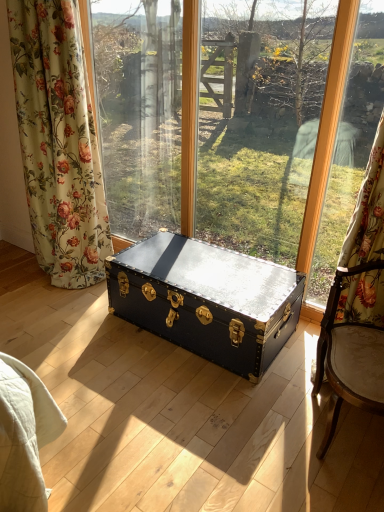
The height and width of the screenshot is (512, 384). I want to click on floral fabric curtain at left, so click(59, 142).

Describe the element at coordinates (59, 142) in the screenshot. This screenshot has width=384, height=512. I see `floral fabric curtain at left` at that location.

Describe the element at coordinates (279, 128) in the screenshot. I see `matte black trunk at center` at that location.

Identify the location of shiny black trunk at center. Image resolution: width=384 pixels, height=512 pixels. (207, 300).

Does shiny black trunk at center come in front of wooden frame at right?

No, the depth of shiny black trunk at center is greater than that of wooden frame at right.

Is point (166, 322) closer to viewer compared to point (299, 257)?

That is True.

From the image's perspective, is shiny black trunk at center below wooden frame at right?

Correct, shiny black trunk at center appears lower than wooden frame at right in the image.

Does matte black trunk at center come in front of wooden frame at right?

No.

Considering the positions of objects matte black trunk at center and wooden frame at right in the image provided, who is more to the right, matte black trunk at center or wooden frame at right?

From the viewer's perspective, wooden frame at right appears more on the right side.

Could wooden frame at right be considered to be inside matte black trunk at center?

No, wooden frame at right is not inside matte black trunk at center.

From the image's perspective, is matte black trunk at center over wooden frame at right?

Yes, from the image's perspective, matte black trunk at center is above wooden frame at right.

Considering the sizes of objects floral fabric curtain at left and matte black trunk at center in the image provided, who is bigger, floral fabric curtain at left or matte black trunk at center?

matte black trunk at center.

Considering the positions of objects floral fabric curtain at left and matte black trunk at center in the image provided, who is more to the left, floral fabric curtain at left or matte black trunk at center?

Positioned to the left is floral fabric curtain at left.

Relative to matte black trunk at center, is floral fabric curtain at left in front or behind?

Clearly, floral fabric curtain at left is behind matte black trunk at center.

From the image's perspective, is floral fabric curtain at left positioned above or below matte black trunk at center?

floral fabric curtain at left is situated higher than matte black trunk at center in the image.

From a real-world perspective, does matte black trunk at center stand above floral fabric curtain at left?

Actually, matte black trunk at center is physically below floral fabric curtain at left in the real world.

Does matte black trunk at center have a lesser width compared to floral fabric curtain at left?

Yes, matte black trunk at center is thinner than floral fabric curtain at left.

Is matte black trunk at center positioned far away from floral fabric curtain at left?

That's right, there is a large distance between matte black trunk at center and floral fabric curtain at left.

Where is `curtain behind the matte black trunk at center`? This screenshot has height=512, width=384. curtain behind the matte black trunk at center is located at coordinates (59, 142).

Is point (25, 74) closer or farther from the camera than point (339, 197)?

Clearly, point (25, 74) is closer to the camera than point (339, 197).

Is floral fabric curtain at left not near wooden frame at right?

Absolutely, floral fabric curtain at left is distant from wooden frame at right.

Is floral fabric curtain at left to the right of wooden frame at right from the viewer's perspective?

No.

Looking at this image, from the image's perspective, relative to wooden frame at right, is floral fabric curtain at left above or below?

Clearly, from the image's perspective, floral fabric curtain at left is above wooden frame at right.

Measure the distance from wooden frame at right to shiny black trunk at center.

wooden frame at right and shiny black trunk at center are 61.19 centimeters apart from each other.

Looking at this image, between wooden frame at right and shiny black trunk at center, which one has smaller width?

With smaller width is wooden frame at right.

Between wooden frame at right and shiny black trunk at center, which one is positioned in front?

Positioned in front is wooden frame at right.

Considering the positions of point (305, 217) and point (159, 320), is point (305, 217) closer or farther from the camera than point (159, 320)?

Point (305, 217).

This screenshot has width=384, height=512. I want to click on window that appears above the shiny black trunk at center (from the image's perspective), so click(279, 128).

From the image's perspective, which one is positioned higher, matte black trunk at center or shiny black trunk at center?

matte black trunk at center, from the image's perspective.

Based on their positions, is matte black trunk at center located to the left or right of shiny black trunk at center?

matte black trunk at center is positioned on shiny black trunk at center's right side.

Identify the location of table below the wooden frame at right (from a real-world perspective). (207, 300).

Image resolution: width=384 pixels, height=512 pixels. Find the location of `window located above the wooden frame at right (from a real-world perspective)`. window located above the wooden frame at right (from a real-world perspective) is located at coordinates (279, 128).

Considering their positions, is matte black trunk at center positioned further to wooden frame at right than shiny black trunk at center?

matte black trunk at center lies further to wooden frame at right than the other object.

When comparing their distances from matte black trunk at center, does shiny black trunk at center or floral fabric curtain at left seem further?

shiny black trunk at center is further to matte black trunk at center.

Based on their spatial positions, is wooden frame at right or floral fabric curtain at left further from matte black trunk at center?

Among the two, floral fabric curtain at left is located further to matte black trunk at center.

Which object lies nearer to the anchor point matte black trunk at center, wooden frame at right or shiny black trunk at center?

wooden frame at right lies closer to matte black trunk at center than the other object.

Looking at the image, which one is located further to wooden frame at right, shiny black trunk at center or matte black trunk at center?

matte black trunk at center.

When comparing their distances from matte black trunk at center, does floral fabric curtain at left or shiny black trunk at center seem further?

shiny black trunk at center.

From the image, which object appears to be nearer to wooden frame at right, shiny black trunk at center or floral fabric curtain at left?

shiny black trunk at center is positioned closer to the anchor wooden frame at right.

Based on their spatial positions, is wooden frame at right or floral fabric curtain at left closer to shiny black trunk at center?

Based on the image, wooden frame at right appears to be nearer to shiny black trunk at center.

You are a GUI agent. You are given a task and a screenshot of the screen. Output one action in this format:
    pyautogui.click(x=<x>, y=<y>)
    Task: Click on the table situated between floral fabric curtain at left and matte black trunk at center from left to right
    Image resolution: width=384 pixels, height=512 pixels.
    Given the screenshot: What is the action you would take?
    pyautogui.click(x=207, y=300)

Identify the location of table between floral fabric curtain at left and wooden frame at right from left to right. (207, 300).

You are a GUI agent. You are given a task and a screenshot of the screen. Output one action in this format:
    pyautogui.click(x=<x>, y=<y>)
    Task: Click on the window frame between matte black trunk at center and shiny black trunk at center in the vertical direction
    
    Given the screenshot: What is the action you would take?
    pyautogui.click(x=343, y=142)

The width and height of the screenshot is (384, 512). I want to click on window between floral fabric curtain at left and wooden frame at right in the horizontal direction, so click(x=279, y=128).